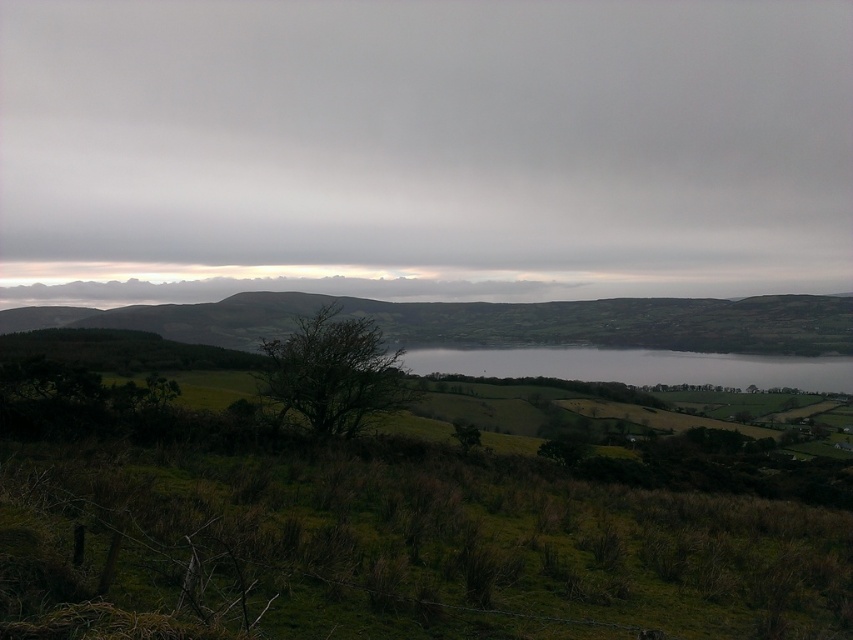
You are a hiker trying to cross the field in the image. You see the green grassy at lower center and the green grassy hillside at lower left. Which area has a smaller size?

The green grassy at lower center is smaller than the green grassy hillside at lower left.

You are standing at the point marked by point (381, 538) in the image. Looking around, what do you see immediately around you?

You are standing in green grassy at lower center, as indicated by the point (381, 538).